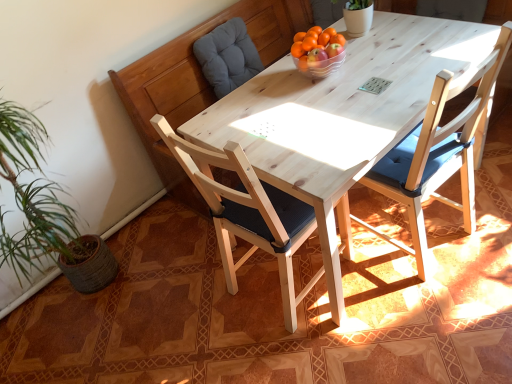
Question: Looking at their shapes, would you say gray fabric cushion at upper left is wider or thinner than translucent glass bowl at center?

Choices:
 (A) thin
 (B) wide

Answer: (B)

Question: Is gray fabric cushion at upper left to the left or to the right of translucent glass bowl at center in the image?

Choices:
 (A) left
 (B) right

Answer: (A)

Question: Based on their relative distances, which object is nearer to the light wood chair at center, which is the first chair in right-to-left order?

Choices:
 (A) translucent glass bowl at center
 (B) natural wood chair at center, which is the 1th chair from left to right
 (C) gray fabric cushion at upper left

Answer: (B)

Question: Estimate the real-world distances between objects in this image. Which object is farther from the natural wood chair at center, which is the 1th chair from left to right?

Choices:
 (A) gray fabric cushion at upper left
 (B) translucent glass bowl at center
 (C) light wood chair at center, the 2th chair viewed from the left

Answer: (A)